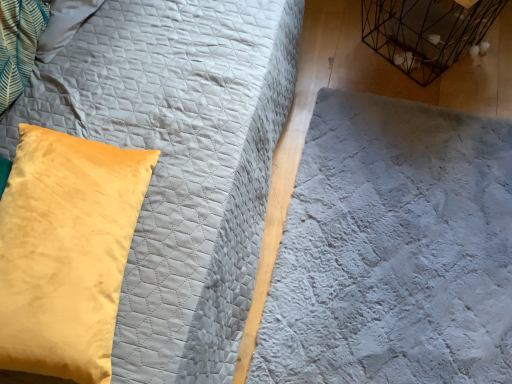
Locate an element on the screen. free space to the left of black wire birdcage at upper right is located at coordinates (358, 57).